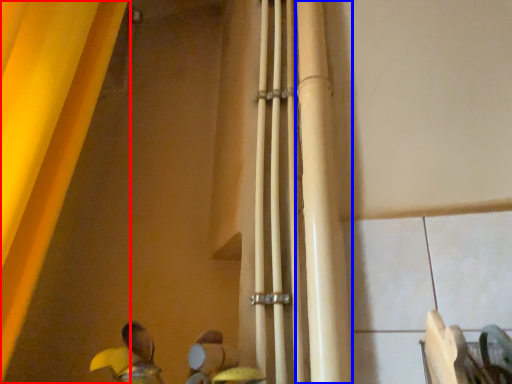
Question: Which point is closer to the camera, curtain (highlighted by a red box) or beam (highlighted by a blue box)?

Choices:
 (A) curtain
 (B) beam

Answer: (A)